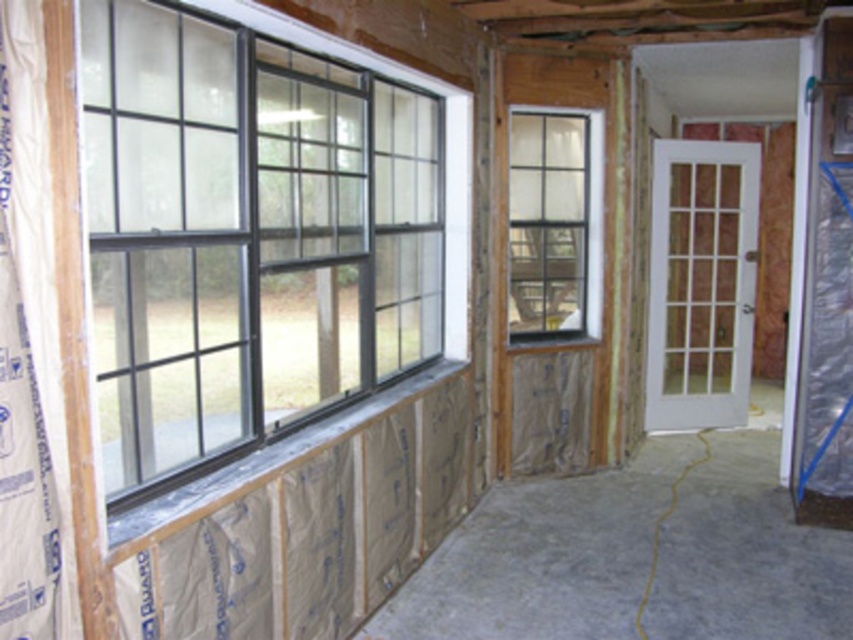
Is black matte window at left bigger than clear glass window at center?

Indeed, black matte window at left has a larger size compared to clear glass window at center.

Is point (158, 484) closer to viewer compared to point (514, 232)?

Yes, point (158, 484) is in front of point (514, 232).

You are a GUI agent. You are given a task and a screenshot of the screen. Output one action in this format:
    pyautogui.click(x=<x>, y=<y>)
    Task: Click on the black matte window at left
    
    Given the screenshot: What is the action you would take?
    247,236